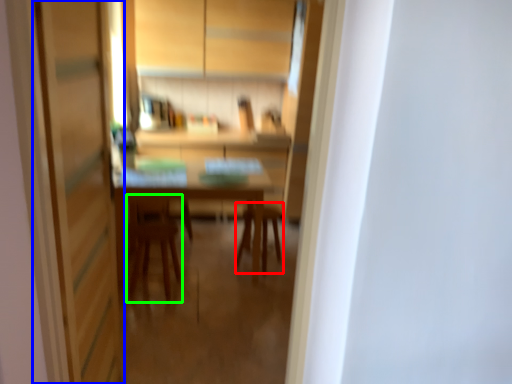
Question: Which object is the farthest from chair (highlighted by a red box)? Choose among these: screen door (highlighted by a blue box) or armchair (highlighted by a green box).

Choices:
 (A) screen door
 (B) armchair

Answer: (A)